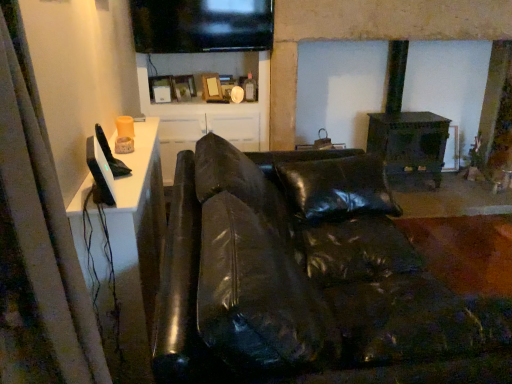
Question: Is black leather couch at center smaller than white fabric curtain at left?

Choices:
 (A) no
 (B) yes

Answer: (A)

Question: Does black leather couch at center have a greater height compared to white fabric curtain at left?

Choices:
 (A) no
 (B) yes

Answer: (B)

Question: From the image's perspective, is black leather couch at center located above white fabric curtain at left?

Choices:
 (A) yes
 (B) no

Answer: (B)

Question: Is black leather couch at center positioned far away from white fabric curtain at left?

Choices:
 (A) yes
 (B) no

Answer: (B)

Question: From a real-world perspective, is black leather couch at center beneath white fabric curtain at left?

Choices:
 (A) yes
 (B) no

Answer: (A)

Question: Is white fabric curtain at left to the left or to the right of black leather couch at center in the image?

Choices:
 (A) right
 (B) left

Answer: (B)

Question: Considering the positions of point (2, 188) and point (297, 256), is point (2, 188) closer or farther from the camera than point (297, 256)?

Choices:
 (A) closer
 (B) farther

Answer: (A)

Question: Is white fabric curtain at left wider or thinner than black leather couch at center?

Choices:
 (A) wide
 (B) thin

Answer: (B)

Question: From a real-world perspective, relative to black leather couch at center, is white fabric curtain at left vertically above or below?

Choices:
 (A) above
 (B) below

Answer: (A)

Question: Is black leather couch at center wider or thinner than white glossy cabinet at upper center?

Choices:
 (A) thin
 (B) wide

Answer: (B)

Question: From a real-world perspective, is black leather couch at center positioned above or below white glossy cabinet at upper center?

Choices:
 (A) above
 (B) below

Answer: (B)

Question: Considering the positions of black leather couch at center and white glossy cabinet at upper center in the image, is black leather couch at center bigger or smaller than white glossy cabinet at upper center?

Choices:
 (A) small
 (B) big

Answer: (B)

Question: Is black leather couch at center taller or shorter than white glossy cabinet at upper center?

Choices:
 (A) short
 (B) tall

Answer: (A)

Question: From the image's perspective, relative to white fabric curtain at left, is white glossy cabinet at upper center above or below?

Choices:
 (A) above
 (B) below

Answer: (A)

Question: In terms of height, does white glossy cabinet at upper center look taller or shorter compared to white fabric curtain at left?

Choices:
 (A) tall
 (B) short

Answer: (A)